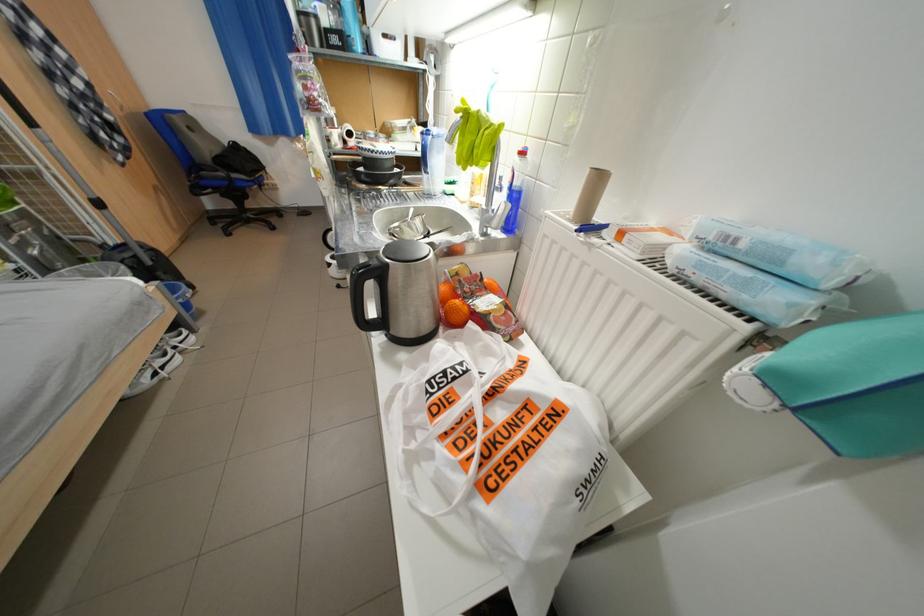
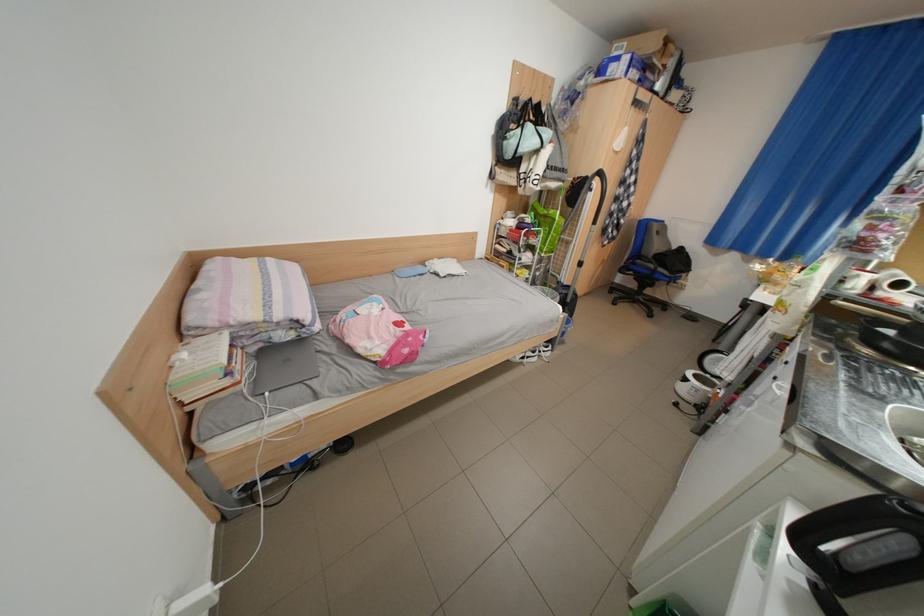
The point at [361,136] is marked in the first image. Where is the corresponding point in the second image?

(912, 286)